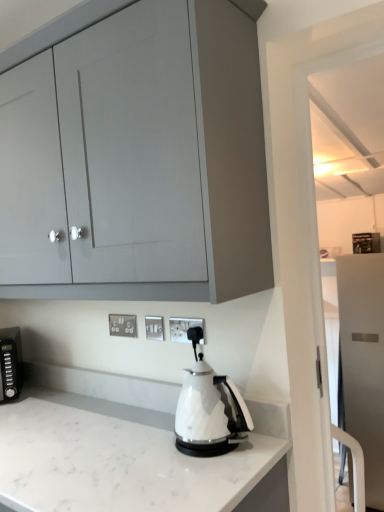
Question: Do you think white marble countertop at center is within matte gray cabinet at upper left, the 2th cabinetry when ordered from back to front, or outside of it?

Choices:
 (A) outside
 (B) inside

Answer: (A)

Question: Is white marble countertop at center wider or thinner than matte gray cabinet at upper left, which is the second cabinetry in right-to-left order?

Choices:
 (A) thin
 (B) wide

Answer: (B)

Question: Estimate the real-world distances between objects in this image. Which object is farther from the white glossy electric kettle at center?

Choices:
 (A) white marble countertop at center
 (B) white plastic electric outlet at center, which is the 3th electric outlet in back-to-front order
 (C) satin white refrigerator at right, placed as the second cabinetry when sorted from left to right
 (D) silver metallic electrical outlet at center, which appears as the 1th electric outlet when viewed from the left
 (E) matte gray cabinet at upper left, the 2th cabinetry when ordered from back to front

Answer: (C)

Question: Estimate the real-world distances between objects in this image. Which object is closer to the silver metallic electrical outlet at center, which appears as the 1th electric outlet when viewed from the left?

Choices:
 (A) white plastic electric outlet at center, the second electric outlet viewed from the front
 (B) white glossy electric kettle at center
 (C) white plastic electric outlet at center, the third electric outlet viewed from the left
 (D) matte gray cabinet at upper left, the 2th cabinetry when ordered from bottom to top
 (E) satin white refrigerator at right, placed as the 1th cabinetry when sorted from right to left

Answer: (A)